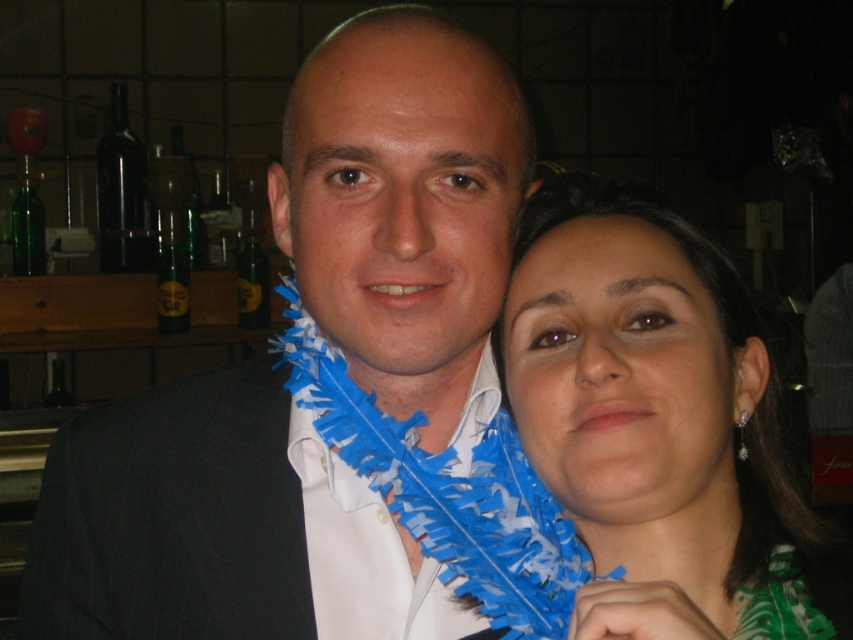
You are a photographer adjusting the lighting for a portrait. You need to ensure that the matte black suit at center and the blue feather boa at right are both well lit. Given their sizes, which object should you adjust the lighting for first to ensure proper exposure?

The matte black suit at center has a greater height compared to the blue feather boa at right, so you should adjust the lighting for the matte black suit at center first to ensure proper exposure due to its larger size.

You are a photographer adjusting your camera settings. You want to focus on the matte black suit at center and the blue feather boa at right. Which object should you adjust the focus to first to ensure both are in sharp focus?

The matte black suit at center is closer to the viewer than the blue feather boa at right, so you should focus on the matte black suit at center first to ensure both are in sharp focus.